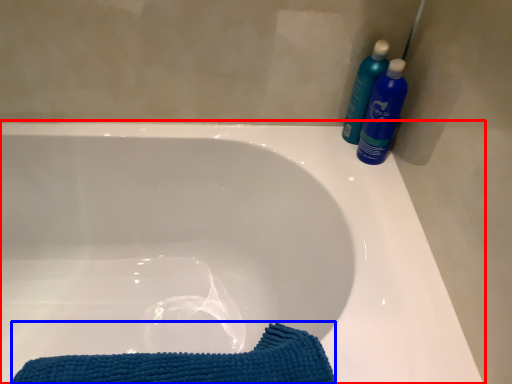
Question: Which object is further to the camera taking this photo, bathtub (highlighted by a red box) or beach towel (highlighted by a blue box)?

Choices:
 (A) bathtub
 (B) beach towel

Answer: (B)